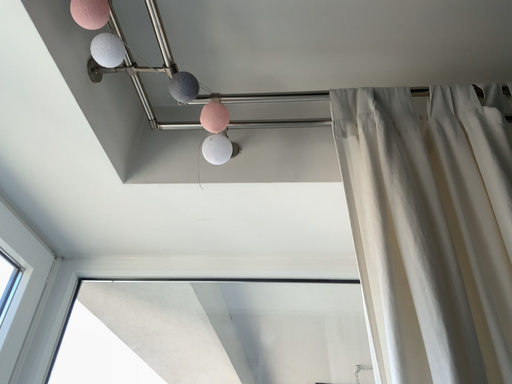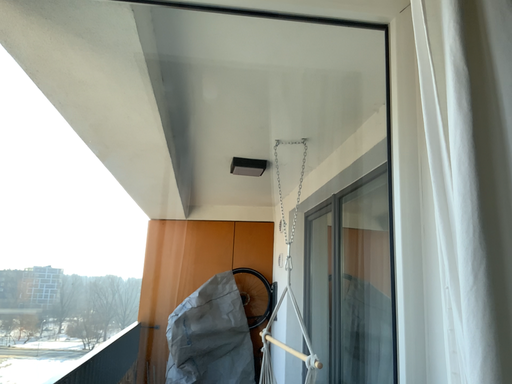
Question: Which way did the camera rotate in the video?

Choices:
 (A) rotated downward
 (B) rotated upward

Answer: (A)